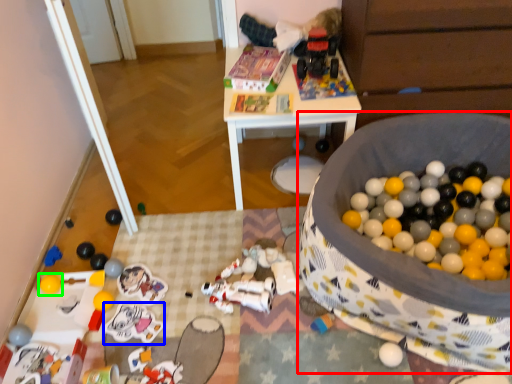
Question: Which object is positioned farthest from toy (highlighted by a red box)? Select from toy (highlighted by a blue box) and toy (highlighted by a green box).

Choices:
 (A) toy
 (B) toy

Answer: (B)